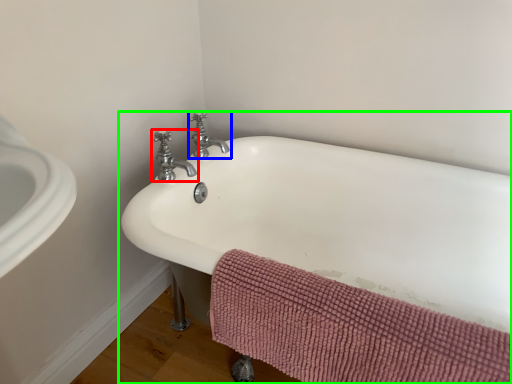
Question: Which object is the farthest from tap (highlighted by a red box)? Choose among these: tap (highlighted by a blue box) or bathtub (highlighted by a green box).

Choices:
 (A) tap
 (B) bathtub

Answer: (B)